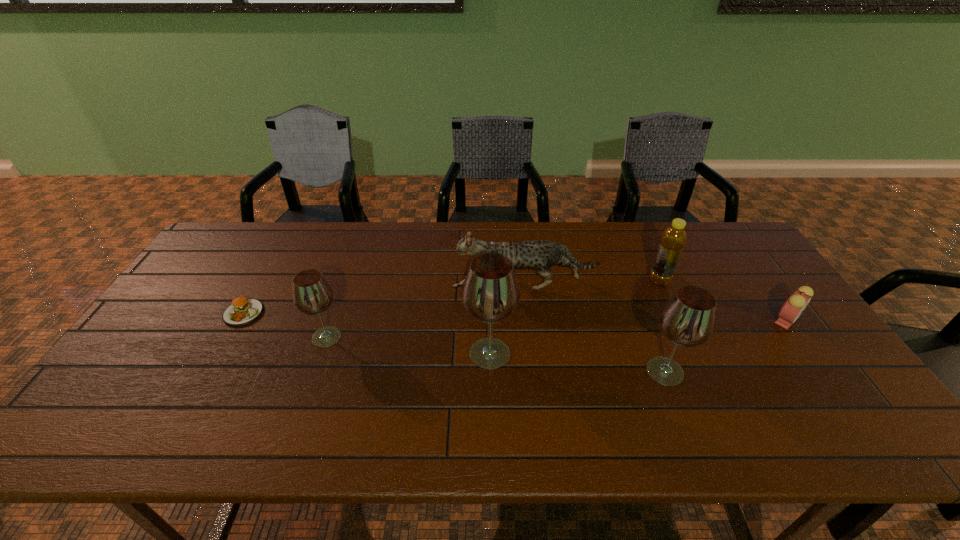
Find the location of a particular element. This screenshot has width=960, height=540. free space between the rightmost wineglass and the alarm clock is located at coordinates (726, 346).

Find the location of a particular element. free space between the second wineglass from left to right and the leftmost object is located at coordinates (367, 333).

I want to click on empty space that is in between the leftmost object and the bottle, so click(x=451, y=297).

Find the location of a particular element. The image size is (960, 540). vacant point located between the cat and the rightmost wineglass is located at coordinates (594, 328).

The image size is (960, 540). Identify the location of empty space that is in between the rightmost object and the leftmost object. (515, 317).

Locate an element on the screen. free space between the second tallest wineglass and the second shortest object is located at coordinates (726, 346).

Locate an element on the screen. The width and height of the screenshot is (960, 540). free spot between the sixth tallest object and the cat is located at coordinates (655, 303).

Identify which object is the sixth nearest to the cat. Please provide its 2D coordinates. Your answer should be formatted as a tuple, i.e. [(x, y)], where the tuple contains the x and y coordinates of a point satisfying the conditions above.

[(243, 310)]

Select which object is the sixth closest to the shortest object. Please provide its 2D coordinates. Your answer should be formatted as a tuple, i.e. [(x, y)], where the tuple contains the x and y coordinates of a point satisfying the conditions above.

[(792, 308)]

I want to click on wineglass that stands as the second closest to the second wineglass from left to right, so click(x=312, y=294).